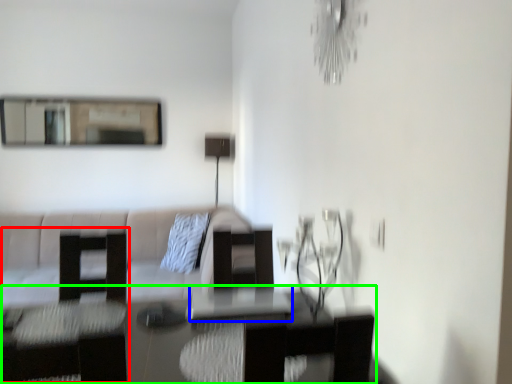
Question: Which object is the closest to the swivel chair (highlighted by a red box)? Choose among these: glass table (highlighted by a blue box) or table (highlighted by a green box).

Choices:
 (A) glass table
 (B) table

Answer: (B)